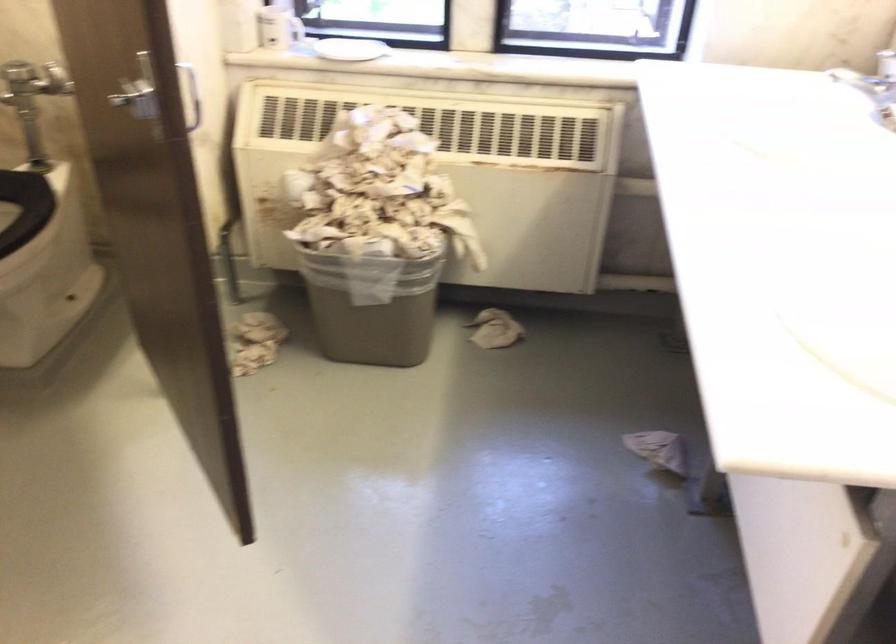
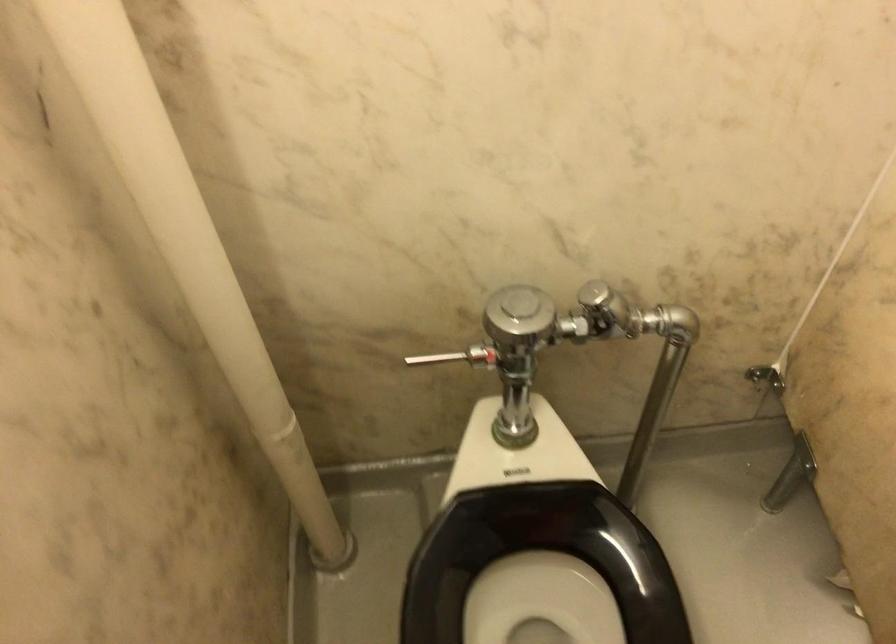
The images are taken continuously from a first-person perspective. In which direction are you moving?

The cameraman walked toward left, forward.